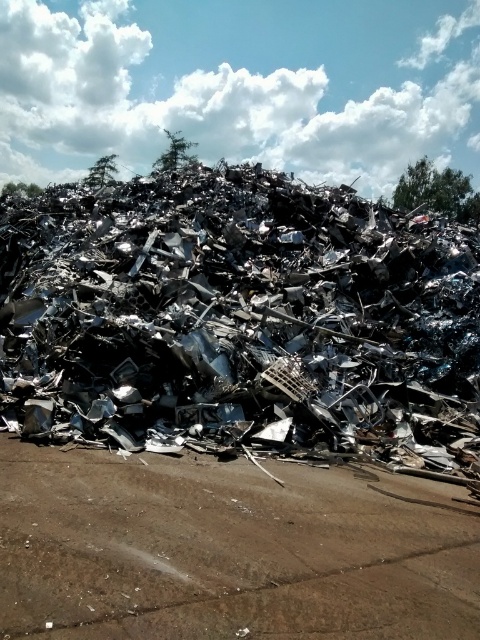
You are standing at the origin point in the image and want to move towards the point labeled point (x=248, y=234). Will you pass by point (x=245, y=531) first?

Yes, because point (x=248, y=234) is behind point (x=245, y=531), so you will pass by point (x=245, y=531) first before reaching point (x=248, y=234).

In the scene shown: You are a delivery truck driver who needs to navigate through the brown dirt track at center. There is a large metallic debris at center blocking your path. Can you safely drive around it without going off the track?

The metallic debris at center might be wider than the brown dirt track at center, so there is a risk that the debris could block the entire track. To safely navigate, you should assess the width of both the debris and the track. If the debris is indeed wider than the track, you would not be able to drive around it without leaving the track. In that case, you should consider an alternative route or wait for the debris to be removed.

You are a delivery driver who needs to drive a truck weighing 10 tons through the area shown. The truck requires a clear path with no obstacles higher than 10 cm. Based on the scene, can you safely drive over the brown dirt track at center without hitting the metallic debris at center?

The metallic debris at center is located above the brown dirt track at center, meaning it is elevated and could pose a collision risk. Since the debris is above the track, driving over the brown dirt track at center might result in the truck hitting the metallic debris at center. Therefore, it is not safe to proceed without first removing or relocating the debris.